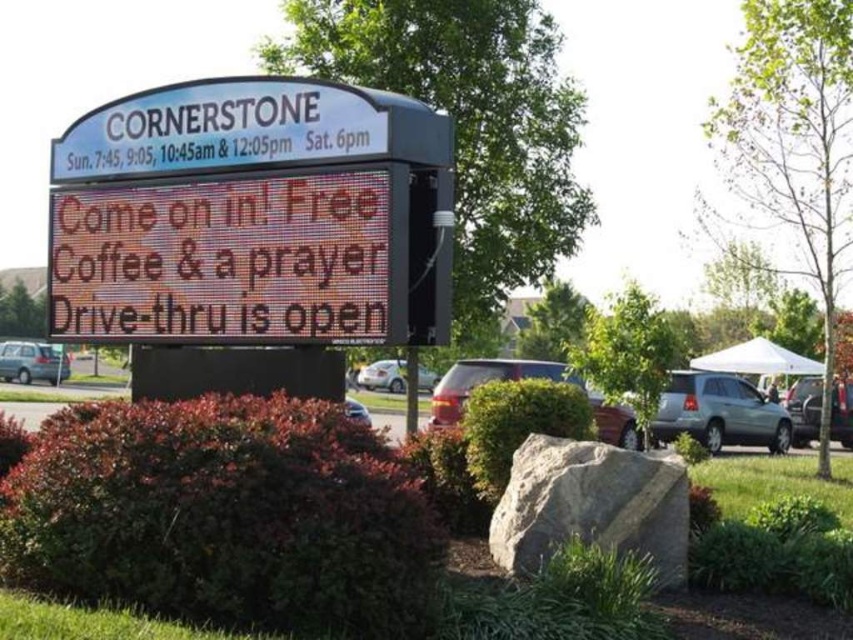
Does silver metallic suv at right have a larger size compared to silver metallic suv at center?

No, silver metallic suv at right is not bigger than silver metallic suv at center.

Which of these two, silver metallic suv at right or silver metallic suv at center, stands shorter?

silver metallic suv at right is shorter.

Which is in front, point (674, 376) or point (792, 422)?

Point (674, 376)

Where is `silver metallic suv at right`? The width and height of the screenshot is (853, 640). silver metallic suv at right is located at coordinates (718, 412).

Which of these two, matte red suv at center or silver metallic sedan at lower left, stands taller?

matte red suv at center

Locate an element on the screen. matte red suv at center is located at coordinates (527, 378).

Locate an element on the screen. The width and height of the screenshot is (853, 640). matte red suv at center is located at coordinates (527, 378).

Based on the photo, between green shrubbery at center and silver metallic suv at center, which one is positioned lower?

silver metallic suv at center is below.

Image resolution: width=853 pixels, height=640 pixels. What do you see at coordinates (233, 522) in the screenshot?
I see `green shrubbery at center` at bounding box center [233, 522].

Based on the photo, who is more forward, (33, 532) or (790, 404)?

Point (33, 532) is in front.

Locate an element on the screen. The image size is (853, 640). green shrubbery at center is located at coordinates (233, 522).